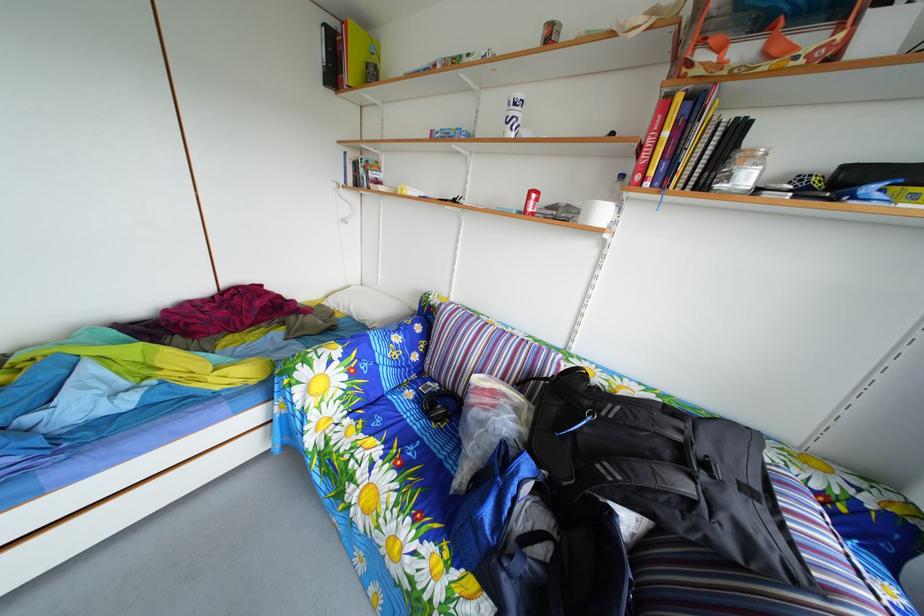
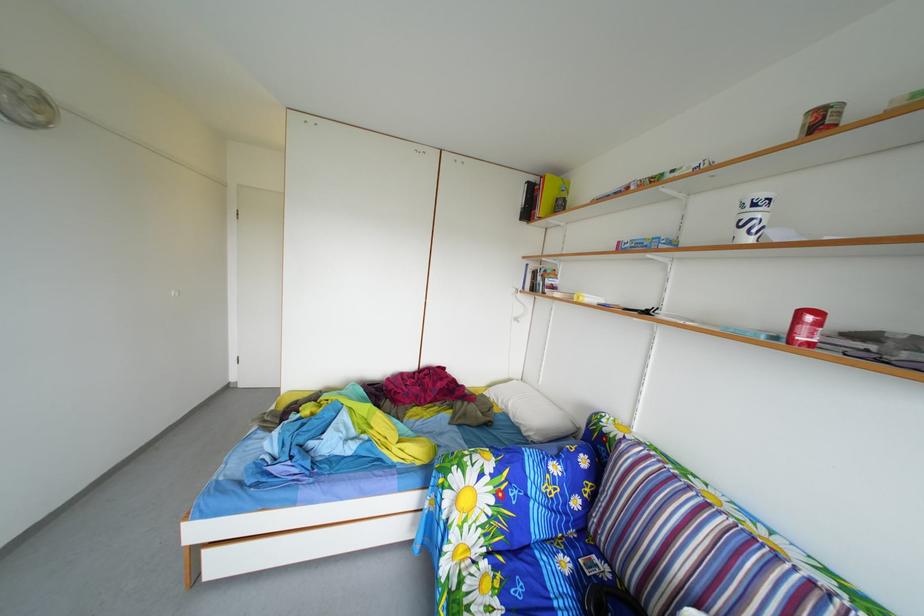
In the second image, find the point that corresponds to (x=302, y=403) in the first image.

(453, 507)